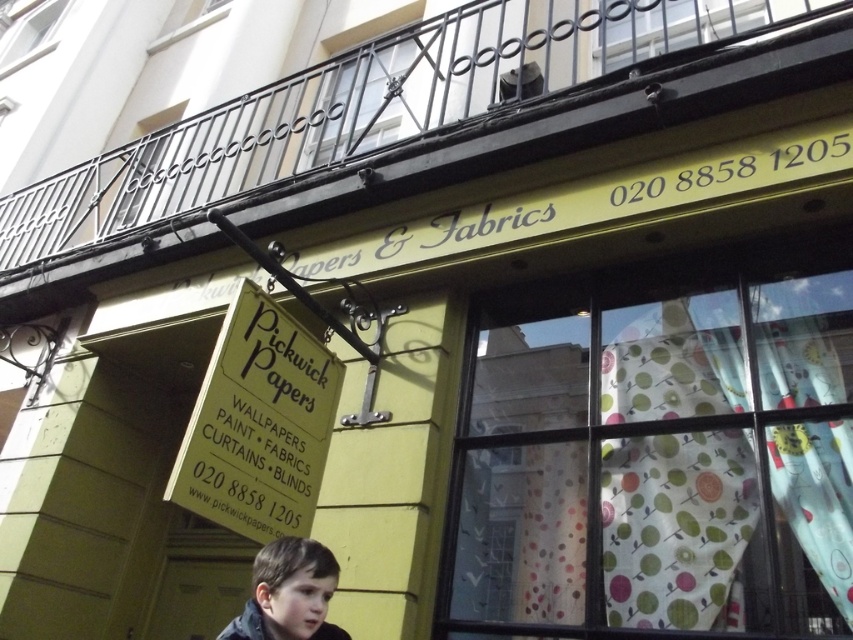
Is polka dot fabric at center positioned before dark brown hair at lower left?

No, polka dot fabric at center is further to the viewer.

In the scene shown: Who is shorter, polka dot fabric at center or dark brown hair at lower left?

With less height is dark brown hair at lower left.

Measure the distance between point (625, 440) and camera.

Point (625, 440) is 2.68 meters away from camera.

At what (x,y) coordinates should I click in order to perform the action: click on polka dot fabric at center. Please return your answer as a coordinate pair (x, y). Looking at the image, I should click on [659, 454].